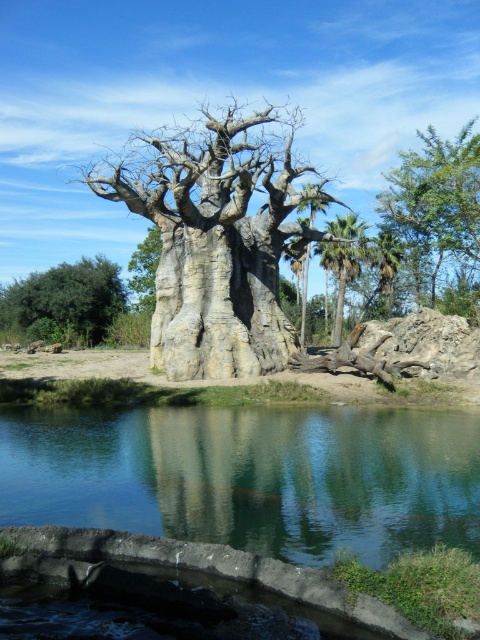
Is clear glass water at lower center taller than rough bark tree at center?

Incorrect, clear glass water at lower center's height is not larger of rough bark tree at center's.

Does clear glass water at lower center appear on the right side of rough bark tree at center?

→ Indeed, clear glass water at lower center is positioned on the right side of rough bark tree at center.

You are a GUI agent. You are given a task and a screenshot of the screen. Output one action in this format:
    pyautogui.click(x=<x>, y=<y>)
    Task: Click on the clear glass water at lower center
    This screenshot has width=480, height=640.
    Given the screenshot: What is the action you would take?
    pyautogui.click(x=250, y=476)

Is green leafy tree at lower left positioned in front of rough bark tree at center?

That is True.

Is point (93, 310) closer to viewer compared to point (137, 252)?

Yes, it is.

This screenshot has width=480, height=640. Identify the location of green leafy tree at lower left. tap(63, 301).

Who is more distant from viewer, (326, 502) or (478, 188)?

The point (478, 188) is behind.

Does clear glass water at lower center appear on the left side of green leafy tree at upper right?

Yes, clear glass water at lower center is to the left of green leafy tree at upper right.

Which is behind, point (399, 493) or point (479, 211)?

The point (479, 211) is more distant.

Identify the location of clear glass water at lower center. (250, 476).